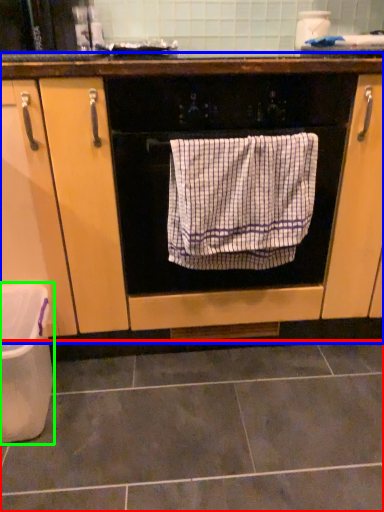
Question: Which object is positioned closest to ceramic tile (highlighted by a red box)? Select from cabinetry (highlighted by a blue box) and dish washer (highlighted by a green box).

Choices:
 (A) cabinetry
 (B) dish washer

Answer: (B)